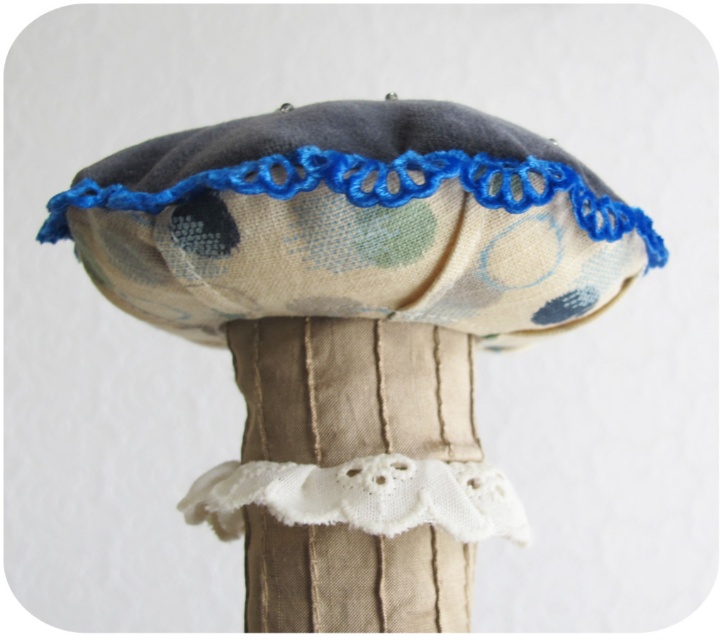
Question: Considering the relative positions of floral fabric hat at upper center and white lace trim at center in the image provided, where is floral fabric hat at upper center located with respect to white lace trim at center?

Choices:
 (A) above
 (B) below

Answer: (A)

Question: Among these points, which one is farthest from the camera?

Choices:
 (A) (290, 627)
 (B) (240, 483)
 (C) (391, 228)

Answer: (B)

Question: Which point is closer to the camera taking this photo?

Choices:
 (A) (184, 508)
 (B) (476, 515)
 (C) (510, 259)
 (D) (340, 360)

Answer: (C)

Question: From the image, what is the correct spatial relationship of white textured cloth at center in relation to white lace trim at center?

Choices:
 (A) left
 (B) right

Answer: (B)

Question: Which point is farther from the camera taking this photo?

Choices:
 (A) (379, 385)
 (B) (446, 308)
 (C) (200, 164)
 (D) (227, 465)

Answer: (D)

Question: Can you confirm if floral fabric hat at center is thinner than white lace trim at center?

Choices:
 (A) yes
 (B) no

Answer: (B)